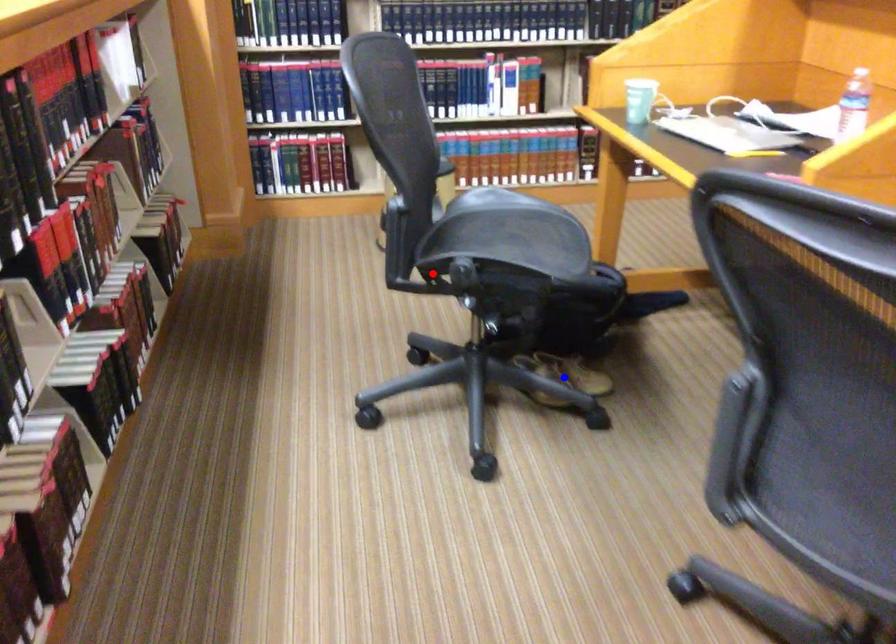
Question: Which of the two points in the image is closer to the camera?

Choices:
 (A) Blue point is closer.
 (B) Red point is closer.

Answer: (B)